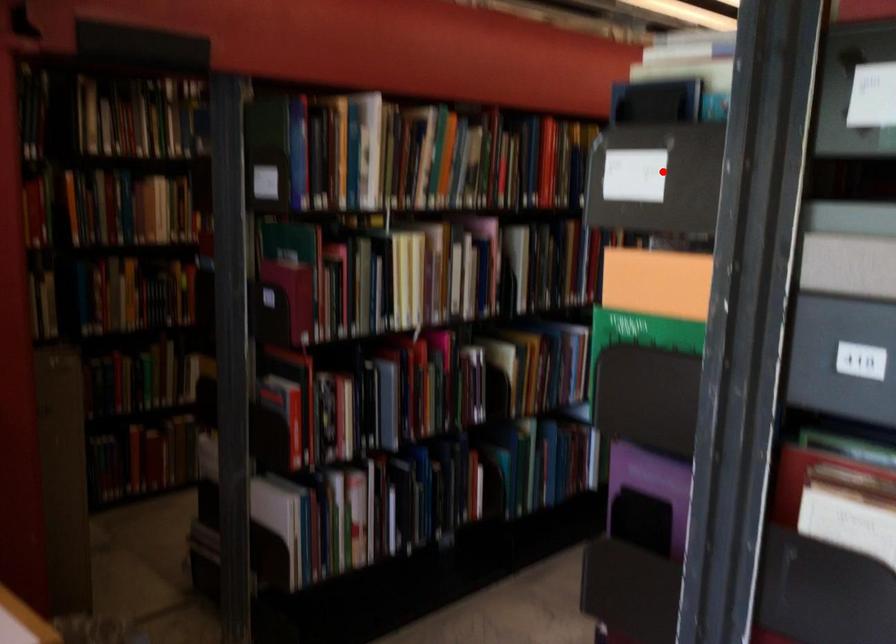
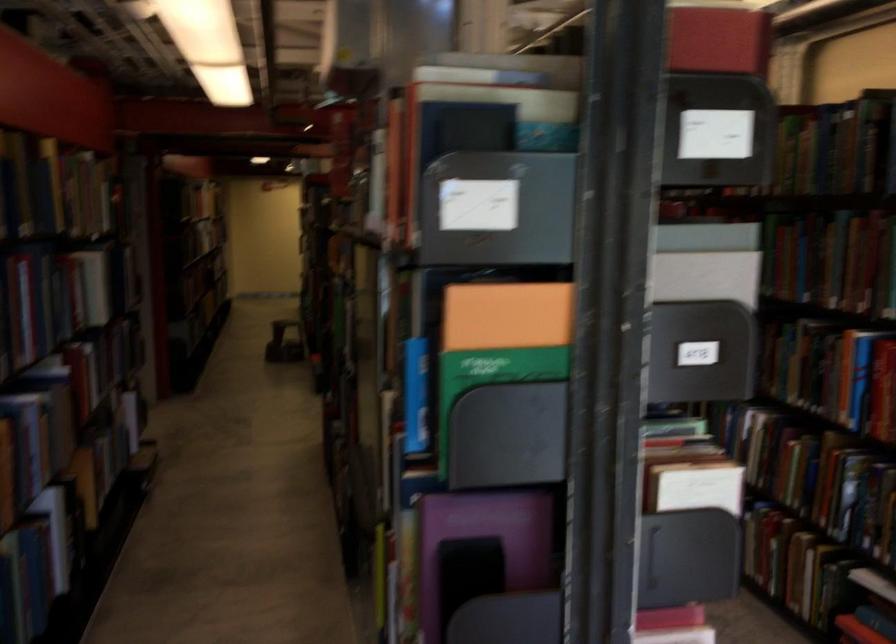
The point at the highlighted location is marked in the first image. Where is the corresponding point in the second image?

(497, 209)